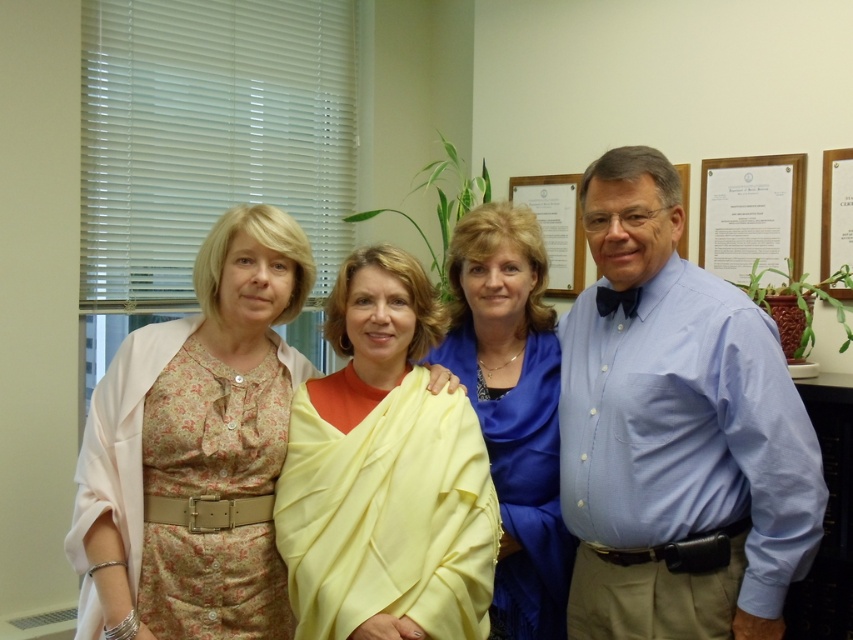
Question: Which object is positioned farthest from the floral dress at left?

Choices:
 (A) yellow satin shawl at center
 (B) blue shirt at right
 (C) wooden framed document at upper right
 (D) blue satin blouse at center

Answer: (C)

Question: From the image, what is the correct spatial relationship of floral fabric dress at left in relation to wooden plaque at upper right?

Choices:
 (A) above
 (B) below

Answer: (B)

Question: Considering the real-world distances, which object is closest to the floral dress at left?

Choices:
 (A) yellow satin shawl at center
 (B) wooden plaque at upper right
 (C) floral fabric dress at left
 (D) wooden framed document at upper right

Answer: (A)

Question: Is yellow satin shawl at center bigger than wooden framed document at upper right?

Choices:
 (A) no
 (B) yes

Answer: (B)

Question: Is floral dress at left thinner than wooden plaque at upper right?

Choices:
 (A) no
 (B) yes

Answer: (A)

Question: Which is farther from the yellow satin shawl at center?

Choices:
 (A) blue shirt at right
 (B) floral dress at left
 (C) blue satin blouse at center

Answer: (A)